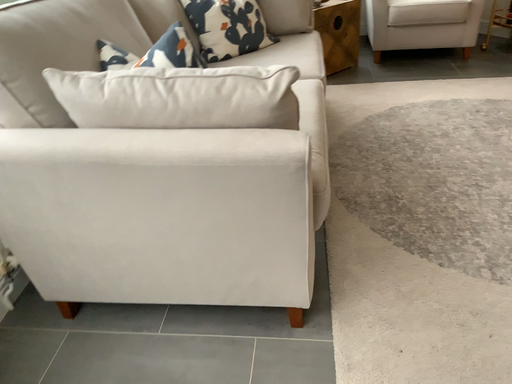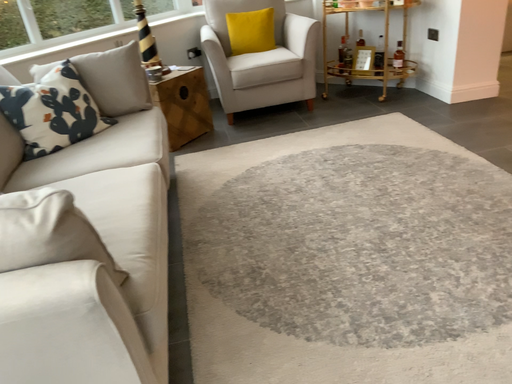
Question: Which way did the camera rotate in the video?

Choices:
 (A) rotated left
 (B) rotated right

Answer: (B)